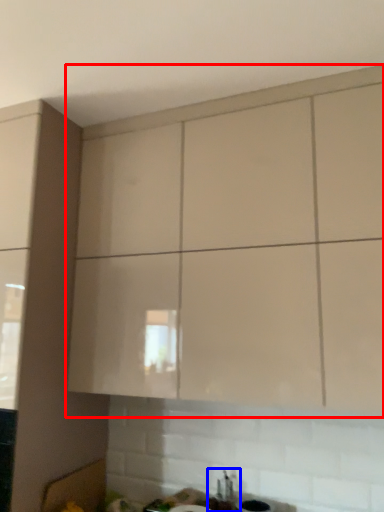
Question: Which of the following is the farthest to the observer, cabinetry (highlighted by a red box) or sink (highlighted by a blue box)?

Choices:
 (A) cabinetry
 (B) sink

Answer: (B)